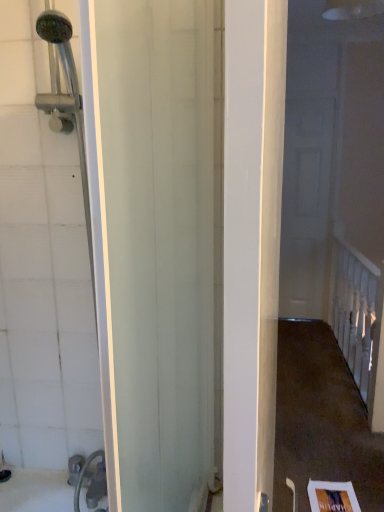
Question: In the image, is white painted wood railing at upper right positioned in front of or behind white glossy door at right?

Choices:
 (A) behind
 (B) front

Answer: (B)

Question: From the image's perspective, relative to white glossy door at right, is white painted wood railing at upper right above or below?

Choices:
 (A) below
 (B) above

Answer: (A)

Question: Is point (339, 311) closer or farther from the camera than point (309, 289)?

Choices:
 (A) closer
 (B) farther

Answer: (A)

Question: Would you say white glossy door at right is inside or outside white painted wood railing at upper right?

Choices:
 (A) outside
 (B) inside

Answer: (A)

Question: Is point (306, 110) closer or farther from the camera than point (365, 263)?

Choices:
 (A) closer
 (B) farther

Answer: (B)

Question: From a real-world perspective, is white glossy door at right positioned above or below white painted wood railing at upper right?

Choices:
 (A) below
 (B) above

Answer: (B)

Question: Based on their positions, is white glossy door at right located to the left or right of white painted wood railing at upper right?

Choices:
 (A) left
 (B) right

Answer: (A)